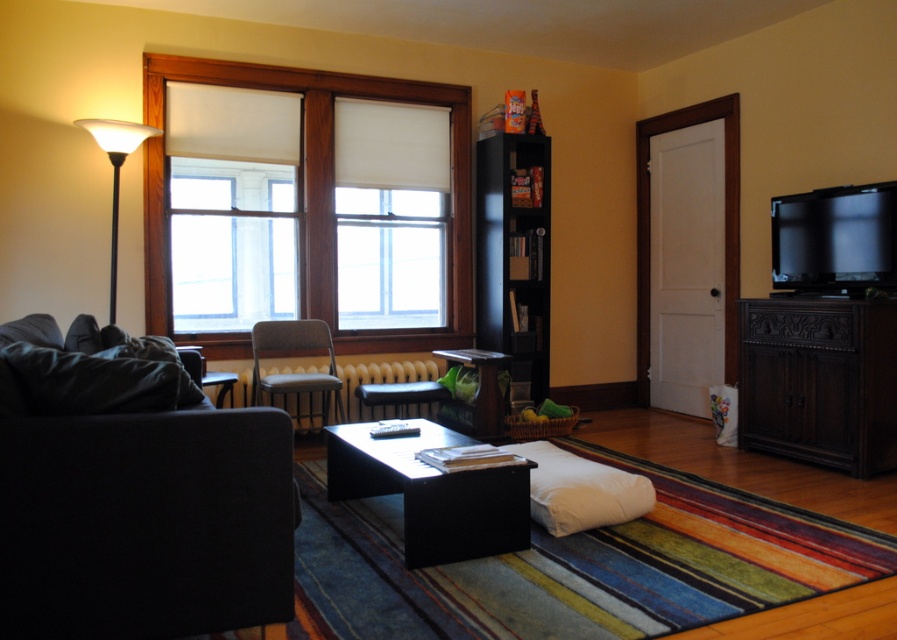
You are standing in the living room and want to know the exact location of the white matte window at upper left. Can you tell me its coordinates?

The white matte window at upper left is located at coordinates point (311, 196).

You are a delivery robot with a package that is 36 inches wide. You need to move from the entrance to the sofa. There is a white matte window at upper left and a white frosted glass floor lamp at left in your path. Can you pass between them without tilting the package?

The distance between the white matte window at upper left and the white frosted glass floor lamp at left is 35.24 inches. Since the package is 36 inches wide, it is slightly wider than the available space. Therefore, the robot cannot pass between them without tilting the package.

Looking at this image, you are arranging a small potted plant between the white matte window at upper left and the white frosted glass floor lamp at left. Which object should the plant be closer to if you want it to be closer to the wider object?

The white matte window at upper left is wider than the white frosted glass floor lamp at left, so the plant should be placed closer to the white matte window at upper left.